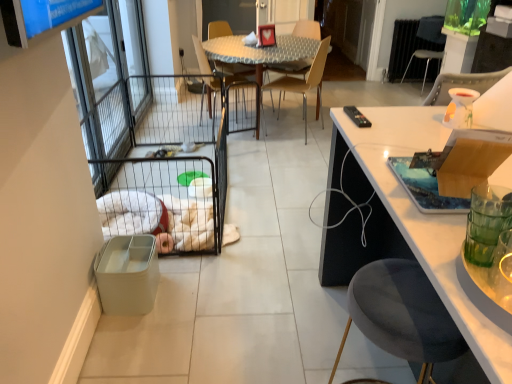
Locate an element on the screen. The width and height of the screenshot is (512, 384). vacant space in front of matte plastic trash bin at lower left is located at coordinates (127, 329).